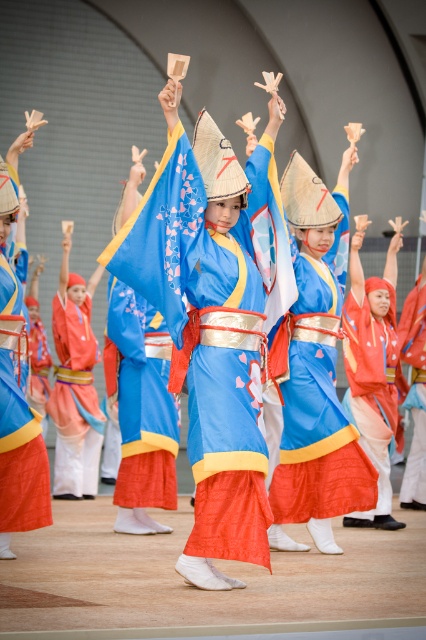
Question: Is blue silk kimono at center thinner than matte red fabric at center?

Choices:
 (A) yes
 (B) no

Answer: (B)

Question: Which is nearer to the matte orange fabric kimono at center?

Choices:
 (A) silky blue robe at center
 (B) blue silk kimono at center

Answer: (B)

Question: Estimate the real-world distances between objects in this image. Which object is farther from the matte orange fabric kimono at center?

Choices:
 (A) matte red fabric at center
 (B) silky blue robe at center

Answer: (B)

Question: From the image, what is the correct spatial relationship of matte red fabric kimono at center in relation to matte red fabric at center?

Choices:
 (A) right
 (B) left

Answer: (A)

Question: Does blue silk kimono at center have a lesser width compared to matte red fabric at center?

Choices:
 (A) yes
 (B) no

Answer: (B)

Question: Among these objects, which one is nearest to the camera?

Choices:
 (A) matte red fabric at center
 (B) blue silk kimono at center
 (C) silky blue robe at center

Answer: (B)